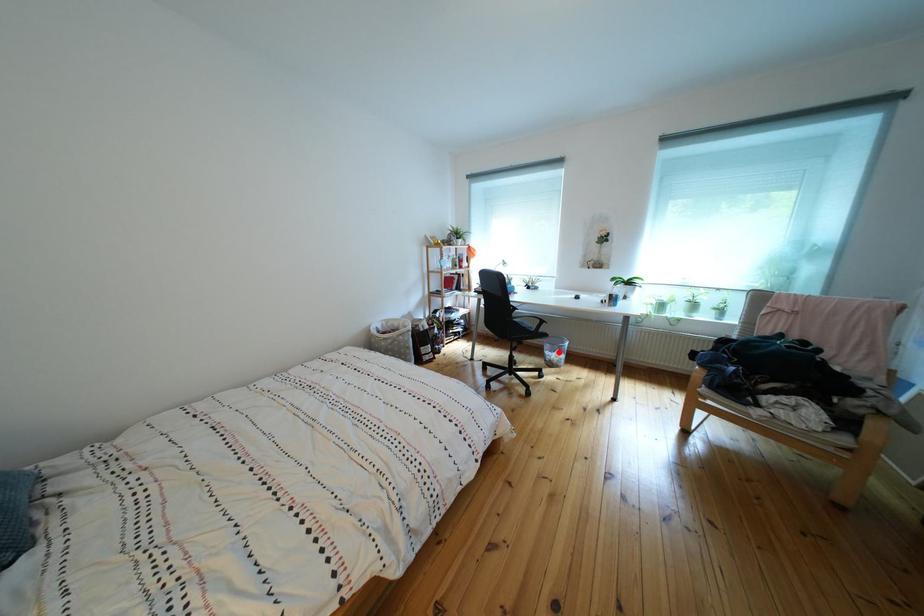
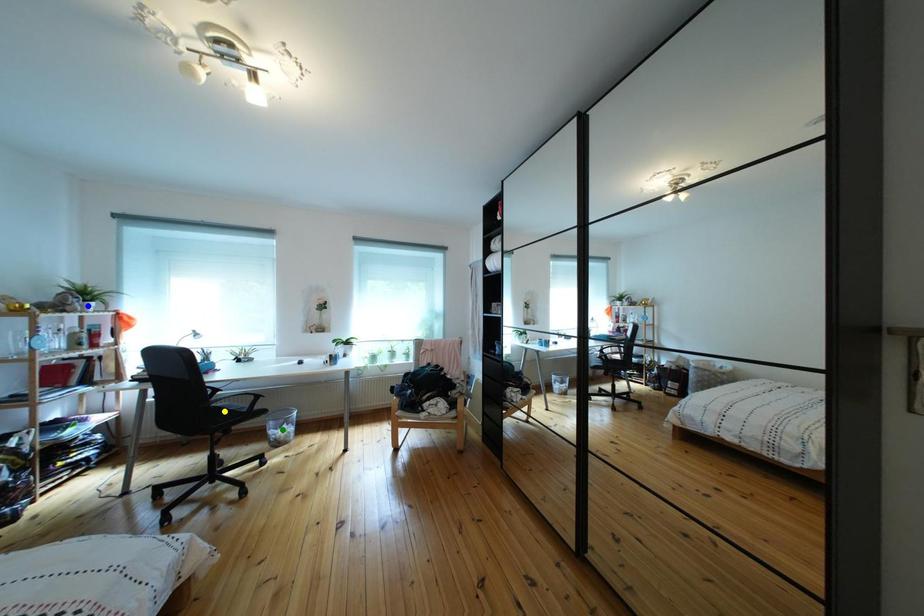
Question: I am providing you with two images of the same scene from different viewpoints. A red point is marked on the first image. You are given multiple points on the second image. Which mark in image 2 goes with the point in image 1?

Choices:
 (A) green point
 (B) blue point
 (C) yellow point

Answer: (A)